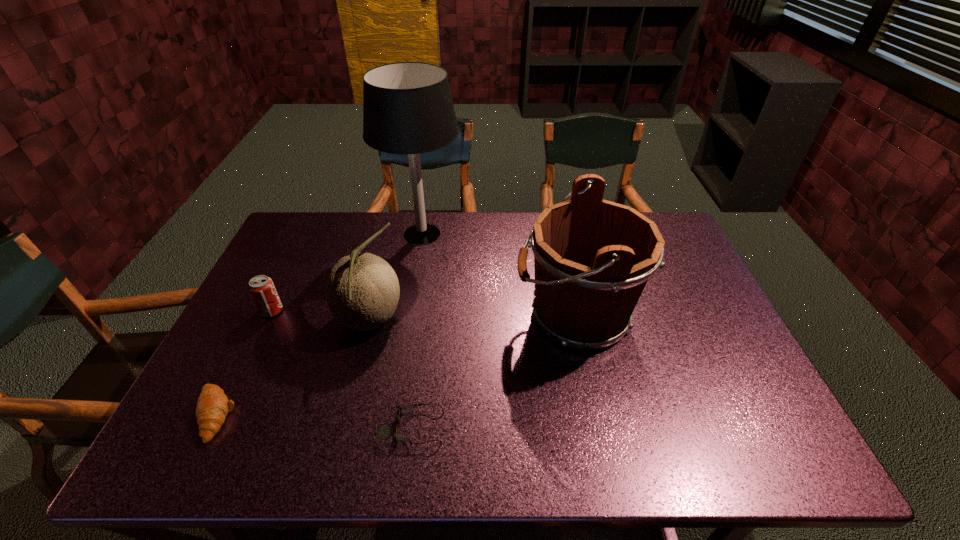
What are the coordinates of `vacant region that satisfies the following two spatial constraints: 1. on the back side of the tallest object; 2. on the left side of the third shortest object` in the screenshot? It's located at (309, 234).

I want to click on vacant space that satisfies the following two spatial constraints: 1. with the handle on the side of the bucket; 2. on the front side of the crescent roll, so 596,414.